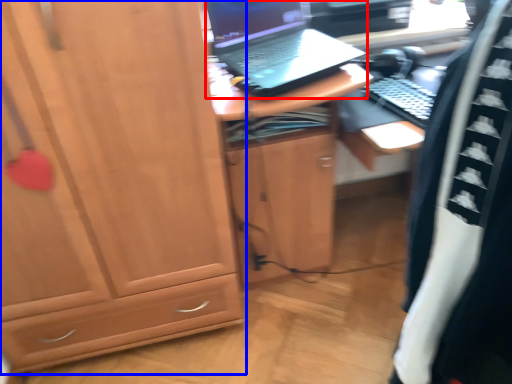
Question: Which point is further to the camera, laptop (highlighted by a red box) or cabinetry (highlighted by a blue box)?

Choices:
 (A) laptop
 (B) cabinetry

Answer: (A)